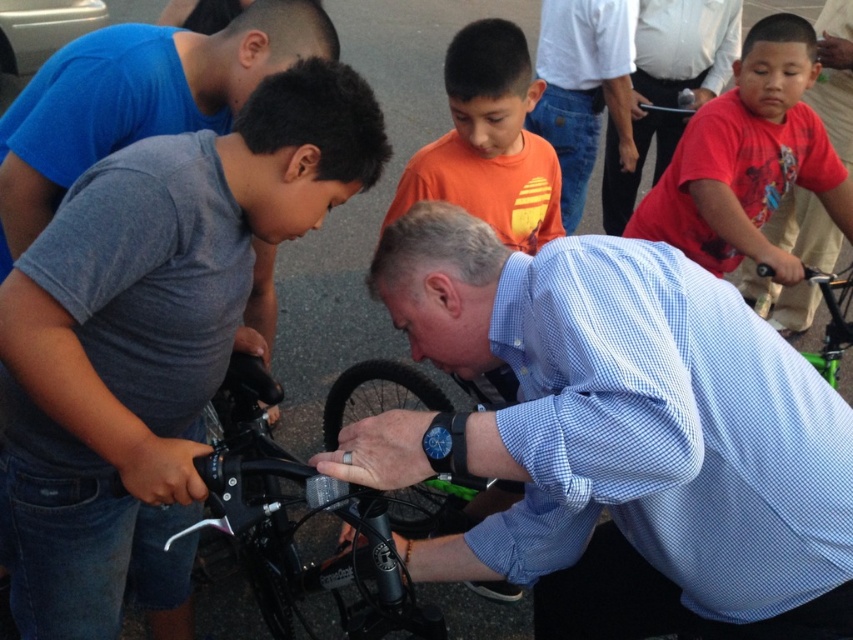
You are a photographer standing in front of the scene. You want to take a photo of the matte red shirt at right and the green matte bicycle at center. Which object should you adjust your camera focus on first if you want both to be in clear view?

The matte red shirt at right is further to the viewer than the green matte bicycle at center, so you should focus on the matte red shirt at right first to ensure both are in clear view.

You are a photographer trying to capture a photo of the green matte bicycle at center without including the matte blue shirt at center in the frame. Based on their positions, is this possible? Explain your reasoning.

The matte blue shirt at center is positioned on the right side of the green matte bicycle at center. Since the shirt is to the right of the bicycle, you can adjust your camera angle to the left side of the bicycle to exclude the shirt from the frame.